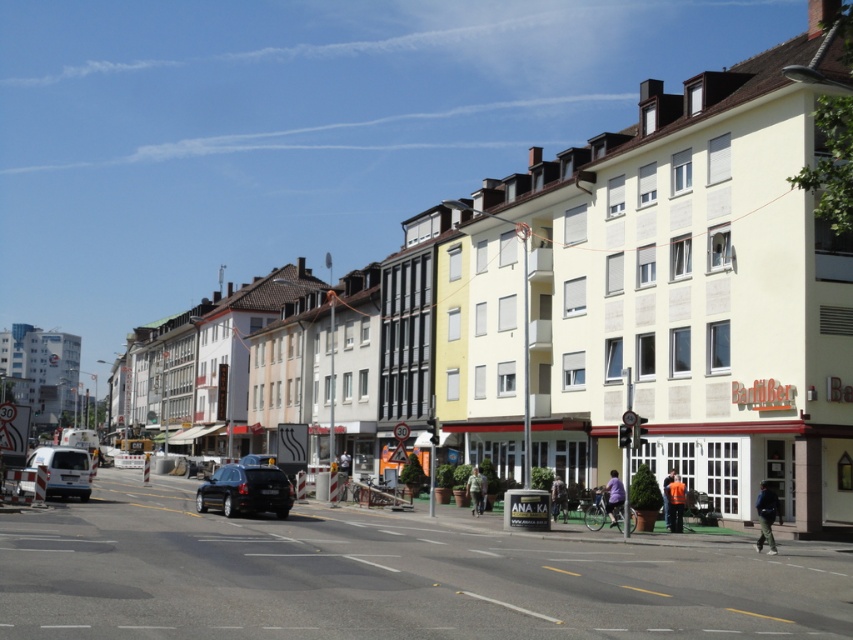
Looking at this image, you are a delivery driver who needs to park your vehicle in a parking spot that has a height restriction of 1.8 meters. You see the shiny black car at center and the white matte van at lower left. Which vehicle is more likely to exceed the height limit?

The white matte van at lower left is taller than the shiny black car at center, so it is more likely to exceed the height restriction of 1.8 meters.

You are a pedestrian standing at the intersection and want to cross the street. You see a shiny black car at center and a white matte van at lower left. Which vehicle is closer to the center of the street?

The shiny black car at center is to the right of the white matte van at lower left, so the shiny black car at center is closer to the center of the street.